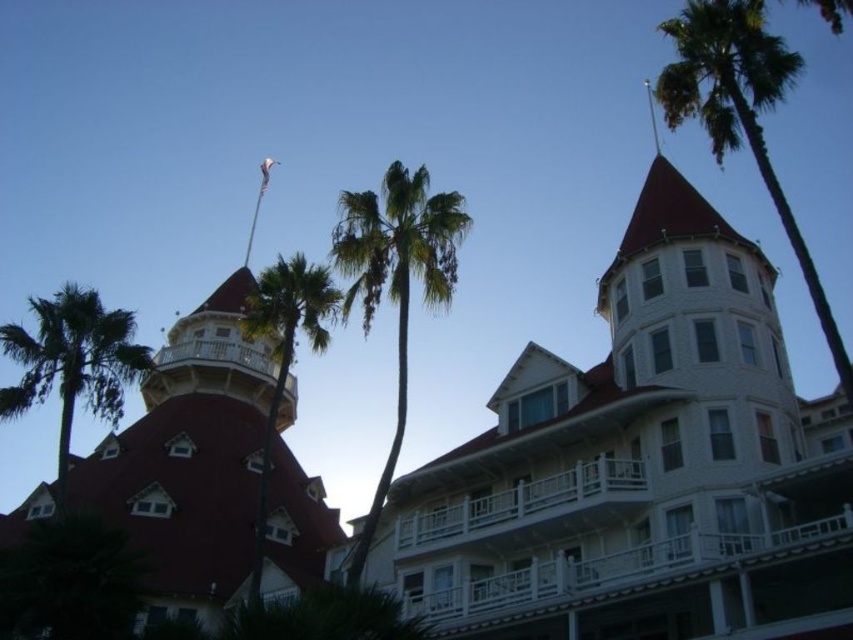
Based on the photo, who is taller, green leafy palm tree at left or green leafy palm tree at upper center?

green leafy palm tree at upper center

Measure the distance from green leafy palm tree at left to green leafy palm tree at upper center.

A distance of 19.22 meters exists between green leafy palm tree at left and green leafy palm tree at upper center.

Find the location of a particular element. This screenshot has height=640, width=853. green leafy palm tree at left is located at coordinates (73, 362).

Does smooth red tower at left have a larger size compared to green leafy palm tree at upper center?

Indeed, smooth red tower at left has a larger size compared to green leafy palm tree at upper center.

Is point (195, 403) positioned in front of point (289, 284)?

No, (195, 403) is behind (289, 284).

Identify the location of smooth red tower at left. This screenshot has width=853, height=640. (190, 460).

Is point (180, 612) behind point (345, 241)?

Yes, it is.

Is smooth red tower at left below green leafy palm tree at center?

Indeed, smooth red tower at left is positioned under green leafy palm tree at center.

Between point (90, 467) and point (399, 244), which one is positioned in front?

Point (399, 244) is in front.

This screenshot has width=853, height=640. I want to click on smooth red tower at left, so click(x=190, y=460).